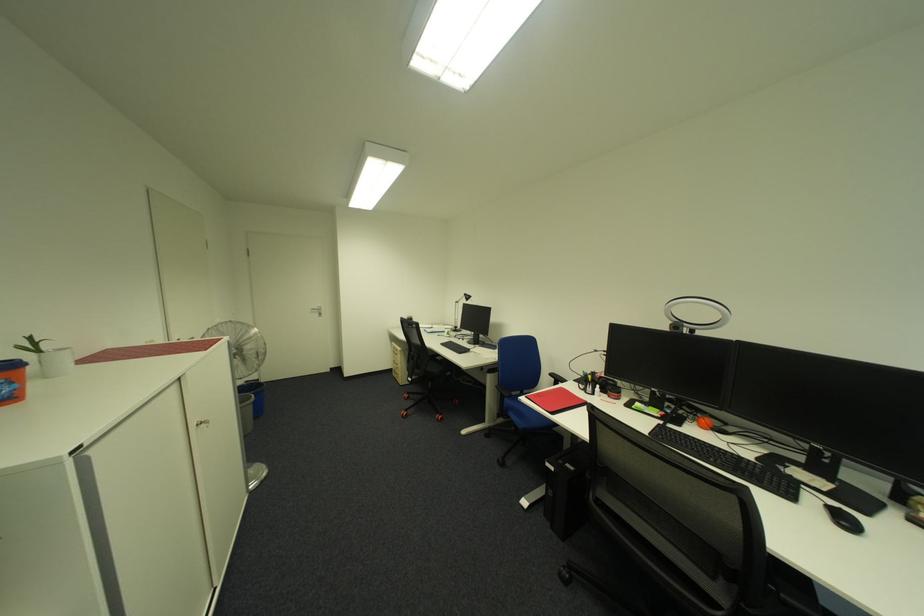
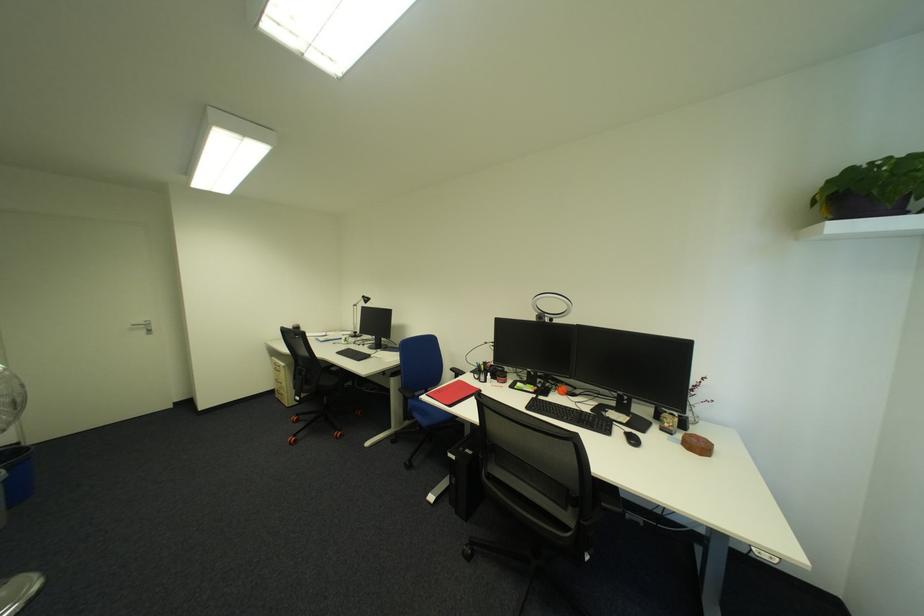
The point at (518, 419) is marked in the first image. Where is the corresponding point in the second image?

(424, 419)